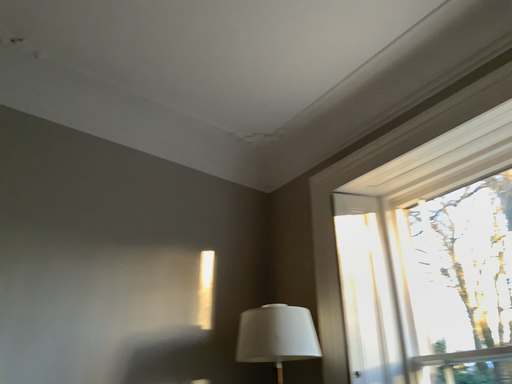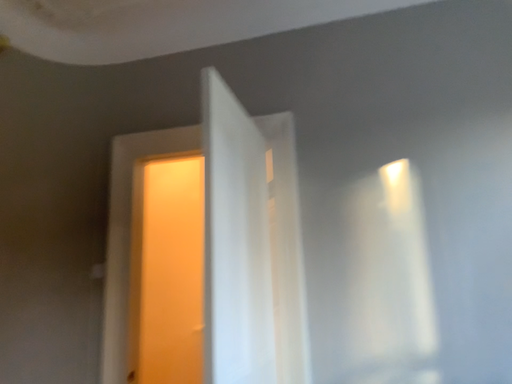
Question: Which way did the camera rotate in the video?

Choices:
 (A) rotated right
 (B) rotated left

Answer: (B)